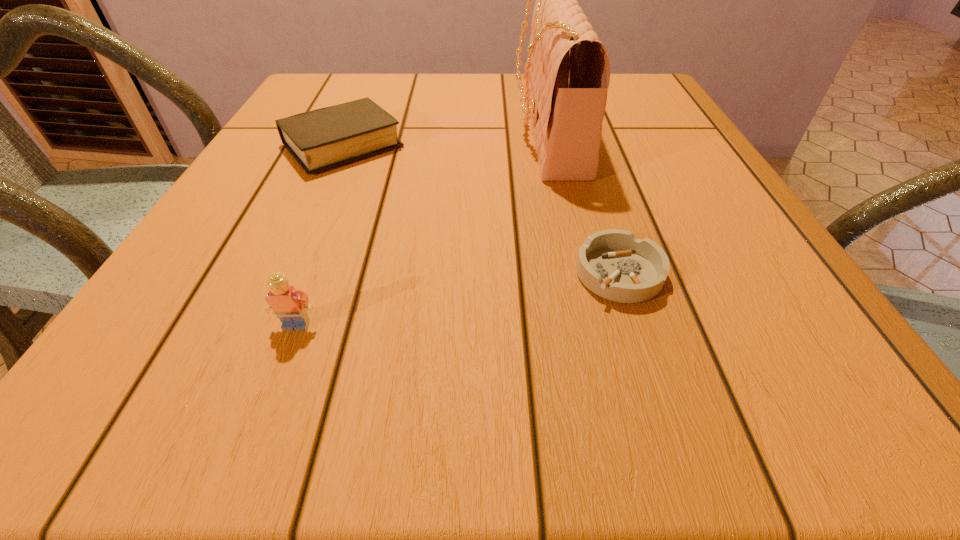
I want to click on blank space located on the back of the Bible, so click(x=371, y=83).

Locate an element on the screen. This screenshot has width=960, height=540. free space located on the back of the third farthest object is located at coordinates (588, 173).

I want to click on object that is at the far edge, so 567,73.

You are a GUI agent. You are given a task and a screenshot of the screen. Output one action in this format:
    pyautogui.click(x=<x>, y=<y>)
    Task: Click on the object located in the left edge section of the desktop
    This screenshot has width=960, height=540.
    Given the screenshot: What is the action you would take?
    pyautogui.click(x=324, y=138)

Image resolution: width=960 pixels, height=540 pixels. I want to click on free spot at the far edge of the desktop, so click(488, 91).

In the image, there is a desktop. At what (x,y) coordinates should I click in order to perform the action: click on vacant space at the near edge. Please return your answer as a coordinate pair (x, y). Image resolution: width=960 pixels, height=540 pixels. Looking at the image, I should click on (557, 400).

In the image, there is a desktop. In order to click on vacant space at the left edge in this screenshot , I will do `click(315, 184)`.

This screenshot has height=540, width=960. I want to click on vacant space at the right edge, so click(681, 269).

Locate an element on the screen. free space at the far right corner is located at coordinates (637, 101).

Identify the location of free space between the Lego and the handbag. The width and height of the screenshot is (960, 540). (421, 228).